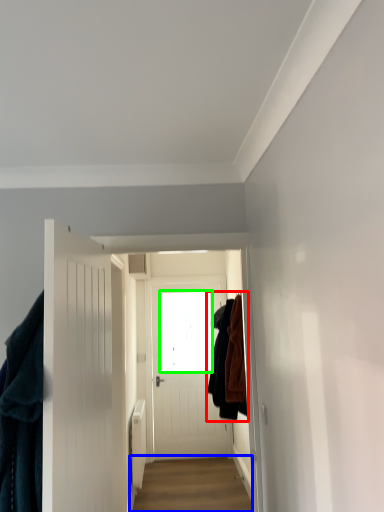
Question: Estimate the real-world distances between objects in this image. Which object is closer to clothing (highlighted by a red box), alley (highlighted by a blue box) or window screen (highlighted by a green box)?

Choices:
 (A) alley
 (B) window screen

Answer: (A)